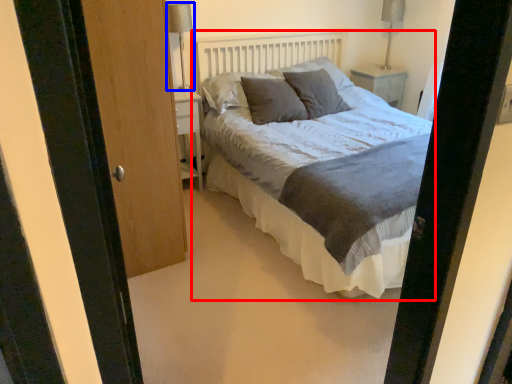
Question: Which object appears farthest to the camera in this image, bed (highlighted by a red box) or table lamp (highlighted by a blue box)?

Choices:
 (A) bed
 (B) table lamp

Answer: (B)